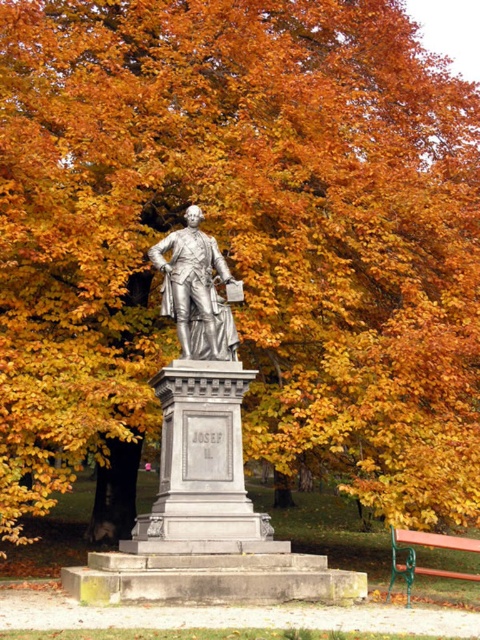
You are a park visitor standing at the entrance of the park. You see the statue represented by point (200, 422). Can you determine the direction of the statue relative to your position?

The statue represented by point (200, 422) is located at the center of the park, so it is directly in front of you from the entrance.